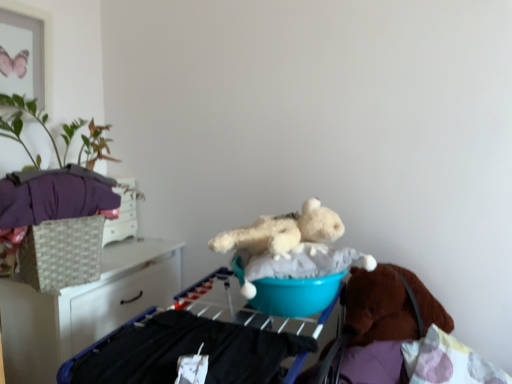
The height and width of the screenshot is (384, 512). What are the coordinates of `free space above teal plastic bucket at center (from a real-world perspective)` in the screenshot? It's located at (204, 333).